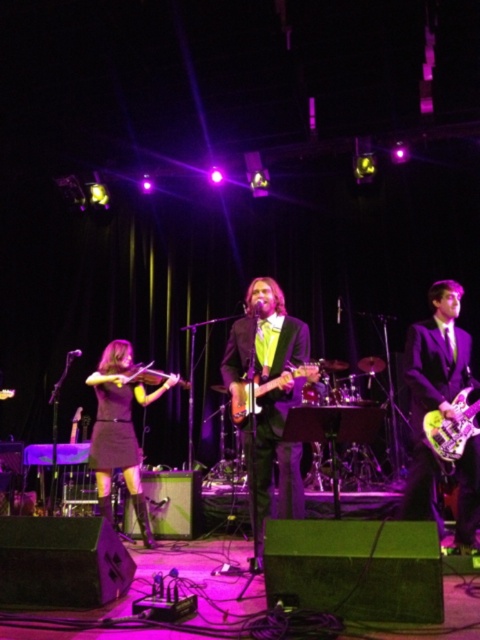
Question: Is shiny black suit at center smaller than matte black violin at left?

Choices:
 (A) no
 (B) yes

Answer: (A)

Question: Can you confirm if matte black violin at left is positioned below wooden acoustic guitar at center?

Choices:
 (A) no
 (B) yes

Answer: (B)

Question: Among these points, which one is nearest to the camera?

Choices:
 (A) (136, 388)
 (B) (453, 465)

Answer: (B)

Question: Which point is farther from the camera taking this photo?

Choices:
 (A) (233, 410)
 (B) (292, 362)
 (C) (134, 380)

Answer: (C)

Question: Where is shiny black suit at center located in relation to wooden acoustic guitar at center in the image?

Choices:
 (A) below
 (B) above

Answer: (A)

Question: Which object is the closest to the matte black violin at left?

Choices:
 (A) wooden acoustic guitar at center
 (B) purple glossy guitar at center
 (C) shiny purple electric guitar at right
 (D) shiny electric guitar at center

Answer: (A)